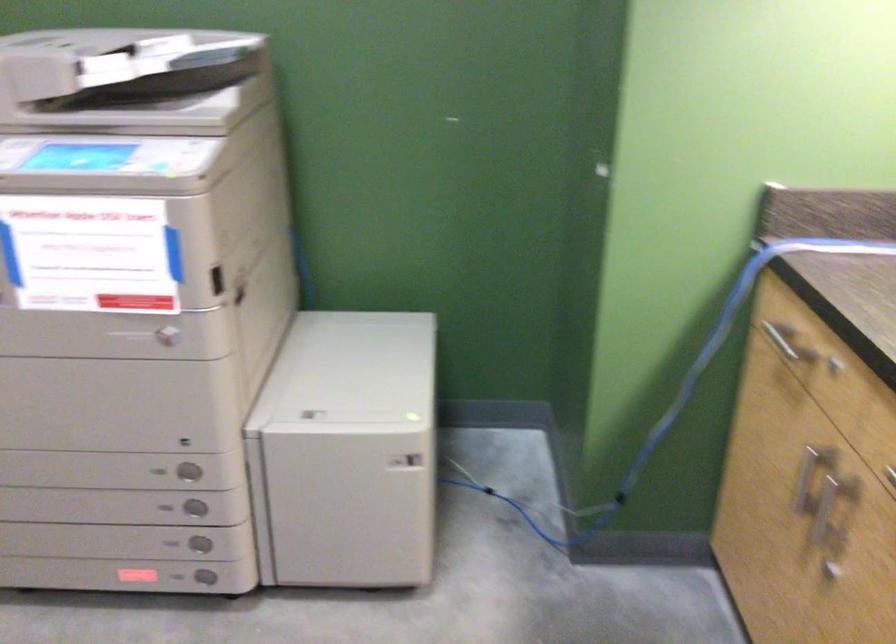
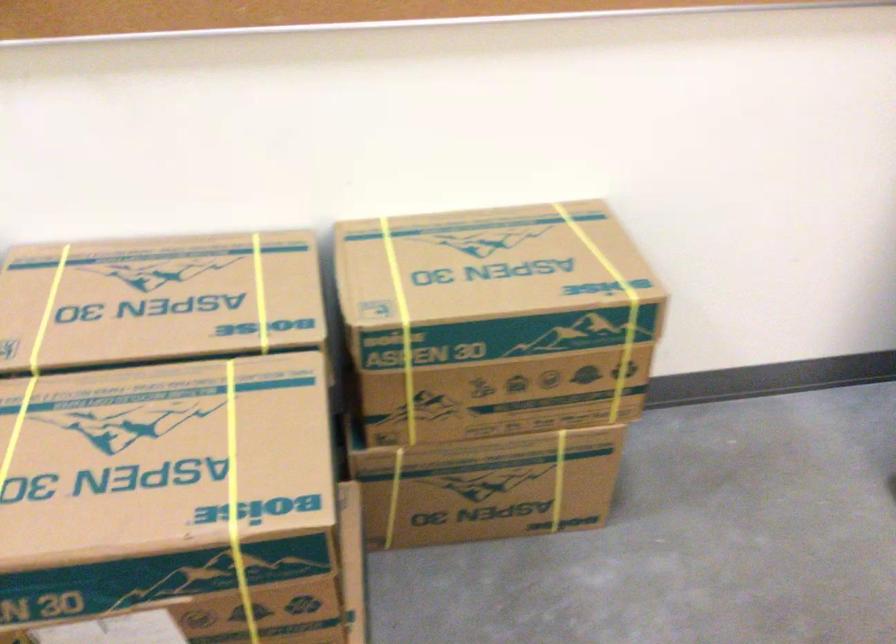
The images are taken continuously from a first-person perspective. In which direction is your viewpoint rotating?

The camera rotated toward left-down.